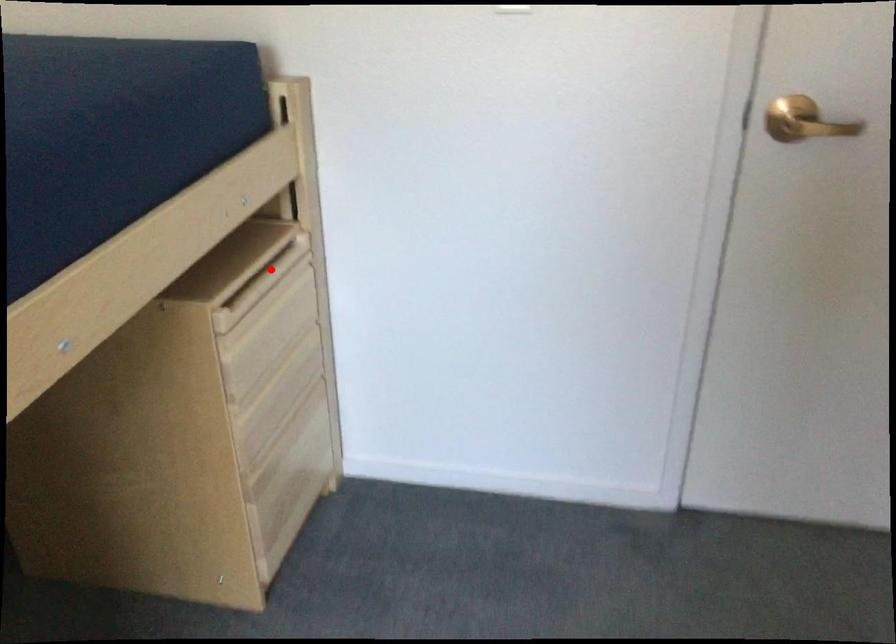
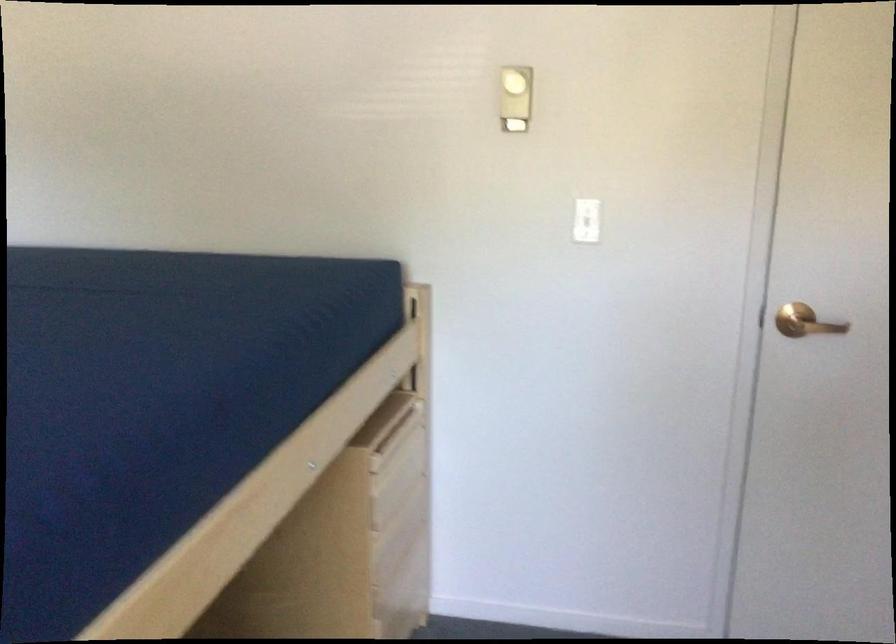
Question: I am providing you with two images of the same scene from different viewpoints. Given a red point in image1, look at the same physical point in image2. Is it:

Choices:
 (A) Closer to the viewpoint
 (B) Farther from the viewpoint

Answer: (B)